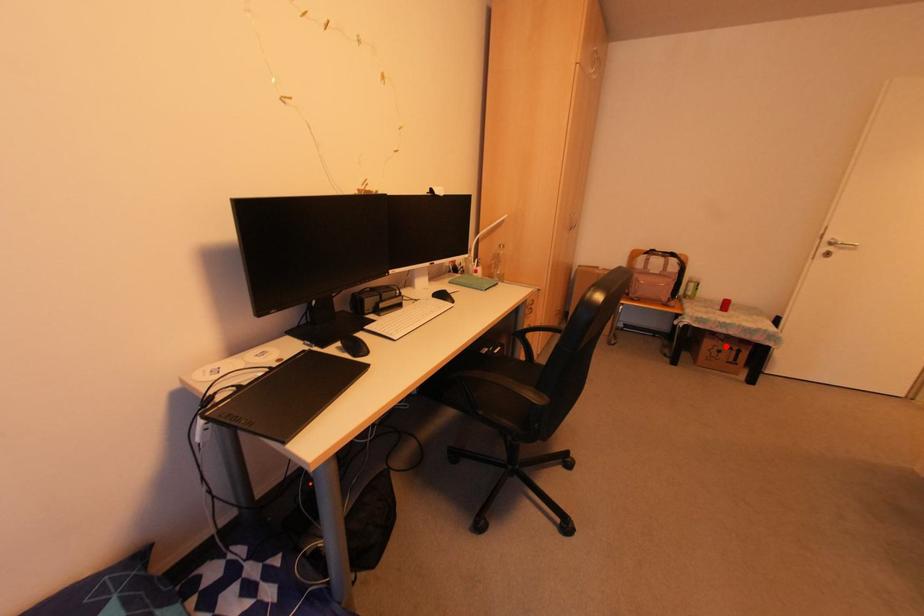
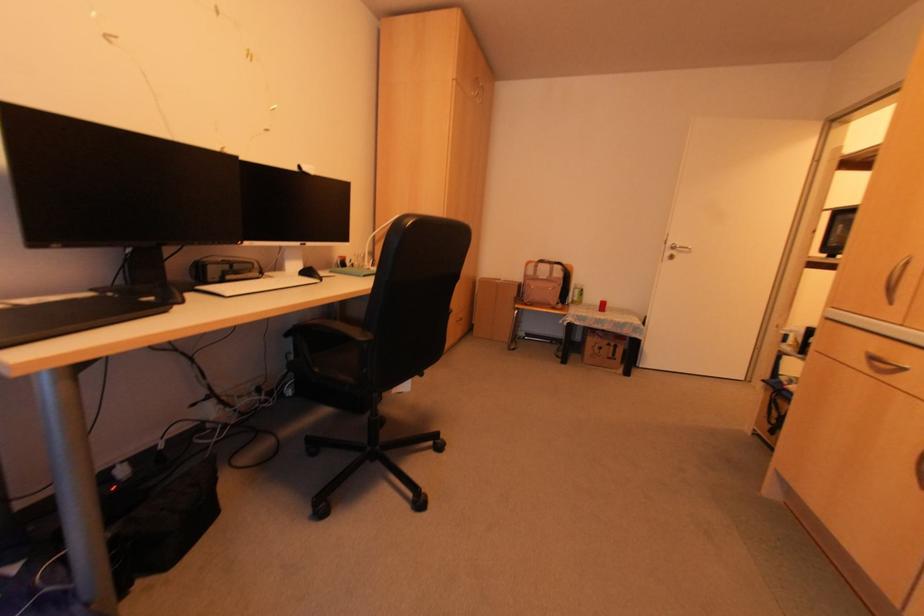
In the second image, find the point that corresponds to the highlighted location in the first image.

(604, 342)